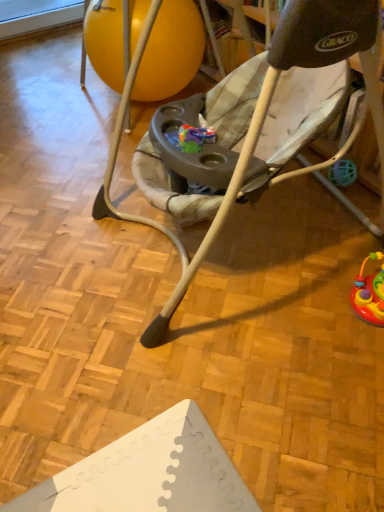
Where is `free space that is to the left of gray fabric baby swing at center`? The width and height of the screenshot is (384, 512). free space that is to the left of gray fabric baby swing at center is located at coordinates (53, 237).